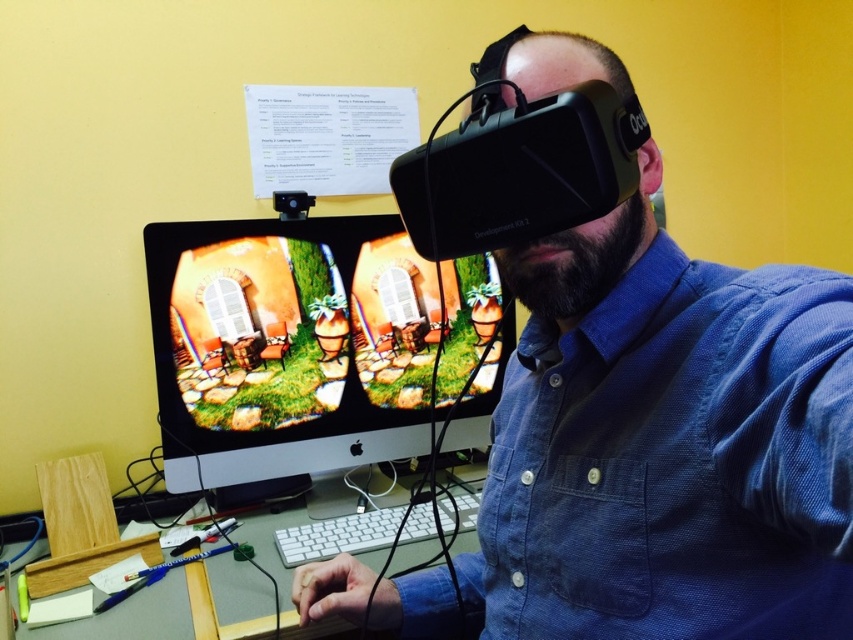
You are setting up a VR setup and need to place the black matte vr headset at center and the matte black monitor at center on a desk. According to the image, which object should be placed lower on the desk?

The black matte vr headset at center should be placed lower on the desk since it is located below the matte black monitor at center in the image.

You are a technician trying to locate the black matte vr headset at center in the image. According to the coordinates provided, where would you find it?

The black matte vr headset at center is located at point coordinates of (657, 451).

You are a delivery person who needs to place a new VR headset and a monitor on a desk that can only accommodate items within 26 inches of each other. The desk already has a black matte vr headset at center and a matte black monitor at center. Can you place the new items without moving the existing ones?

The existing black matte vr headset at center and matte black monitor at center are already 25.99 inches apart, which is within the 26 inches requirement. Therefore, you can place the new items without moving the existing ones.